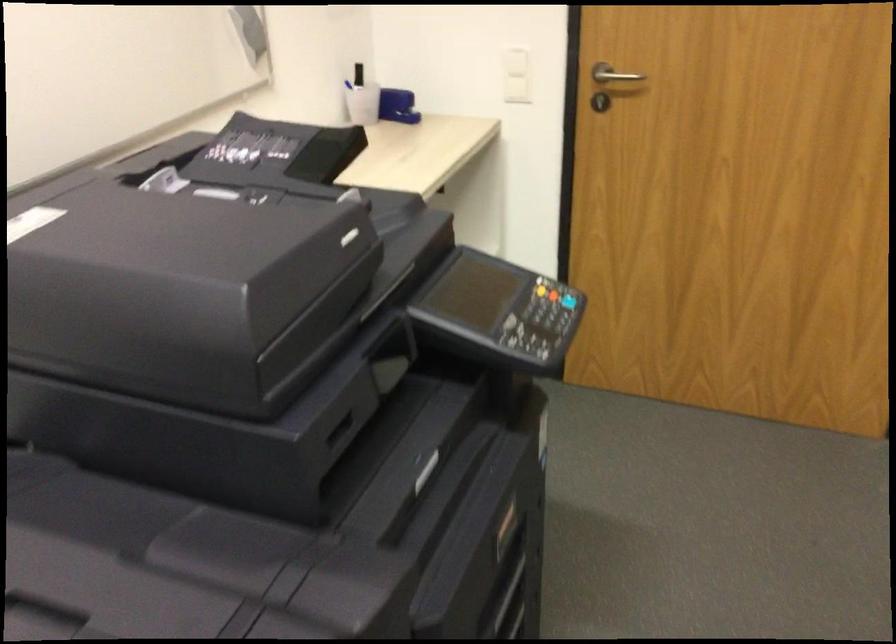
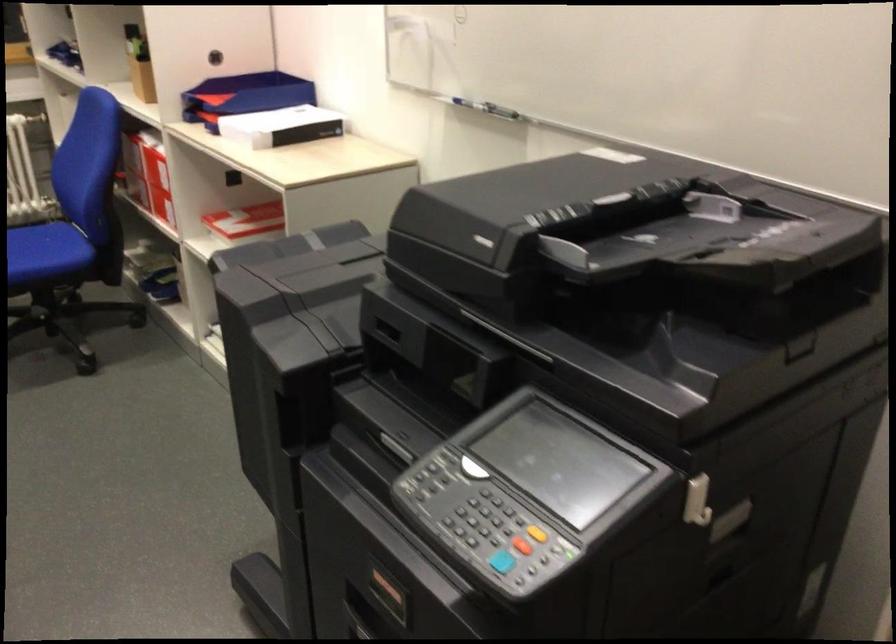
The point at (264, 240) is marked in the first image. Where is the corresponding point in the second image?

(546, 212)